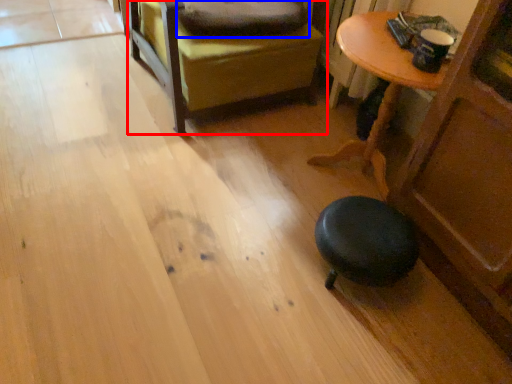
Question: Which object appears farthest to the camera in this image, furniture (highlighted by a red box) or pillow (highlighted by a blue box)?

Choices:
 (A) furniture
 (B) pillow

Answer: (B)